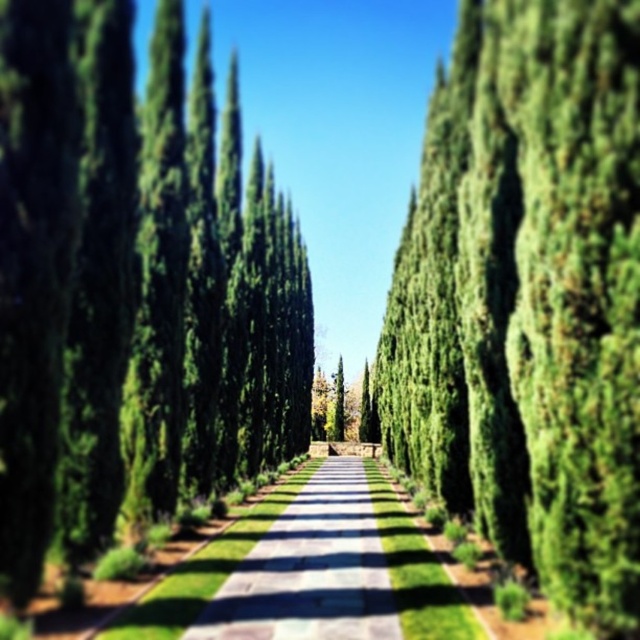
You are a landscape architect designing a garden and want to ensure the green glossy trees at center and the green concrete path at center are proportionate. Based on the scene, which object is taller and should be considered for scaling adjustments?

The green glossy trees at center are taller than the green concrete path at center, so scaling adjustments should focus on ensuring the path does not overshadow the trees.

You are standing at the entrance of the pathway and want to take a photo. There are two points marked in the scene, point (566,364) and point (365,634). Which point should you focus on to ensure it appears larger in your photo?

Point (566,364) is closer to the camera than point (365,634), so focusing on point (566,364) will make it appear larger in the photo.